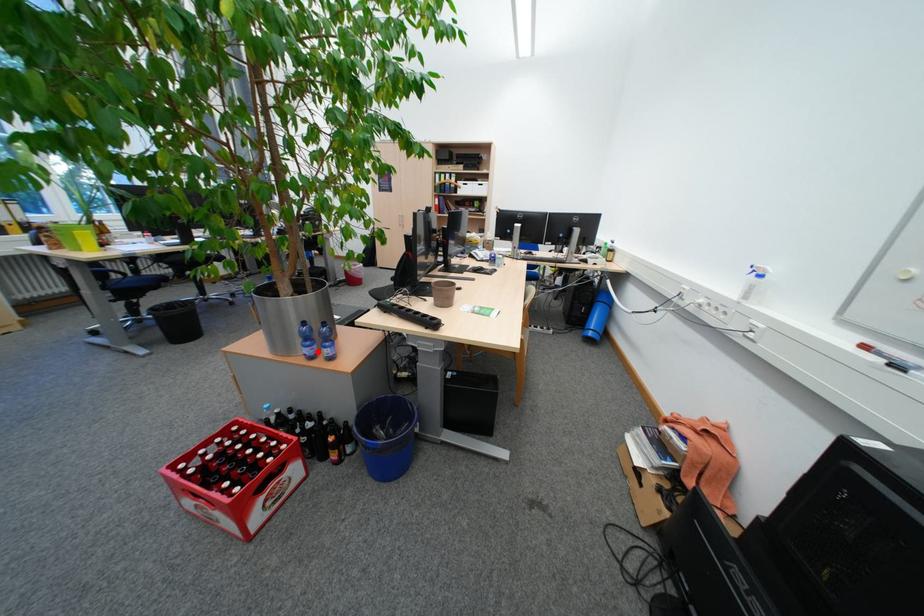
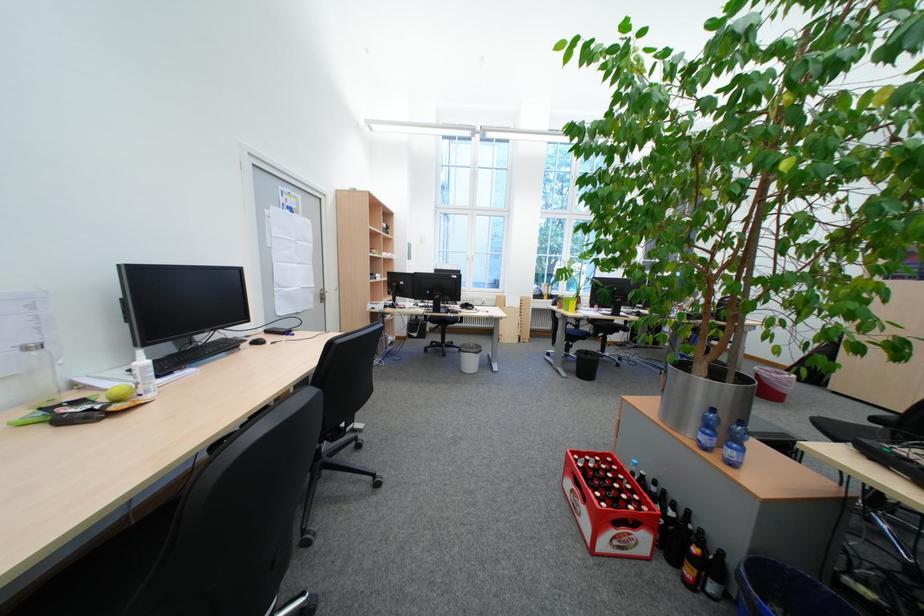
Find the pixel in the second image that matches the highlighted location in the first image.

(714, 439)